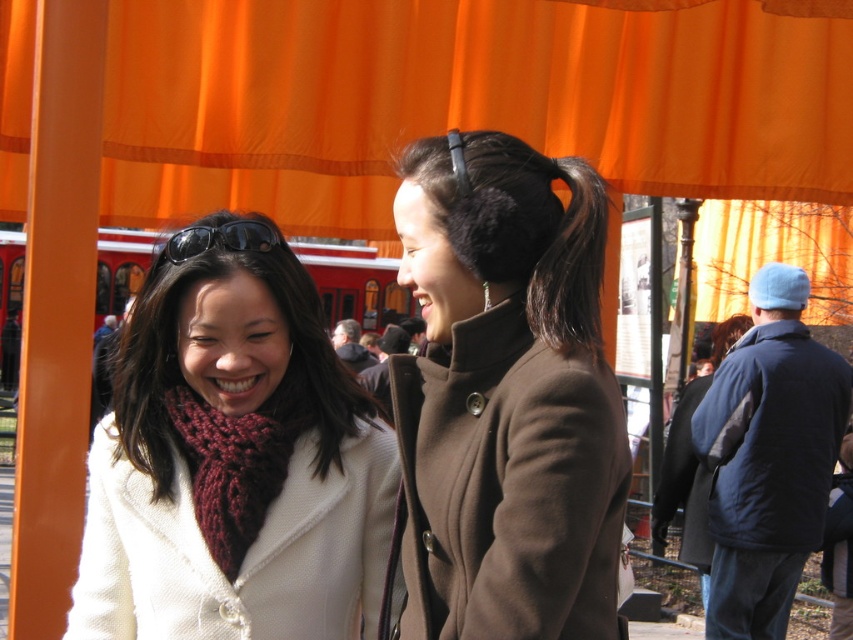
Question: Which of the following is the farthest from the observer?

Choices:
 (A) (326, 460)
 (B) (689, 435)

Answer: (B)

Question: Which point is farther from the camera taking this photo?

Choices:
 (A) (135, 496)
 (B) (698, 570)

Answer: (B)

Question: Which point is closer to the camera?

Choices:
 (A) orange fabric canopy at upper center
 (B) fuzzy black earmuffs at center
 (C) white woolen coat at center
 (D) brown woolen coat at center

Answer: (D)

Question: Is brown woolen coat at center above dark brown silky hair at upper center?

Choices:
 (A) yes
 (B) no

Answer: (B)

Question: Is fuzzy black earmuffs at center positioned behind dark brown silky hair at upper center?

Choices:
 (A) yes
 (B) no

Answer: (B)

Question: Does orange fabric canopy at upper center have a greater width compared to dark brown silky hair at upper center?

Choices:
 (A) no
 (B) yes

Answer: (A)